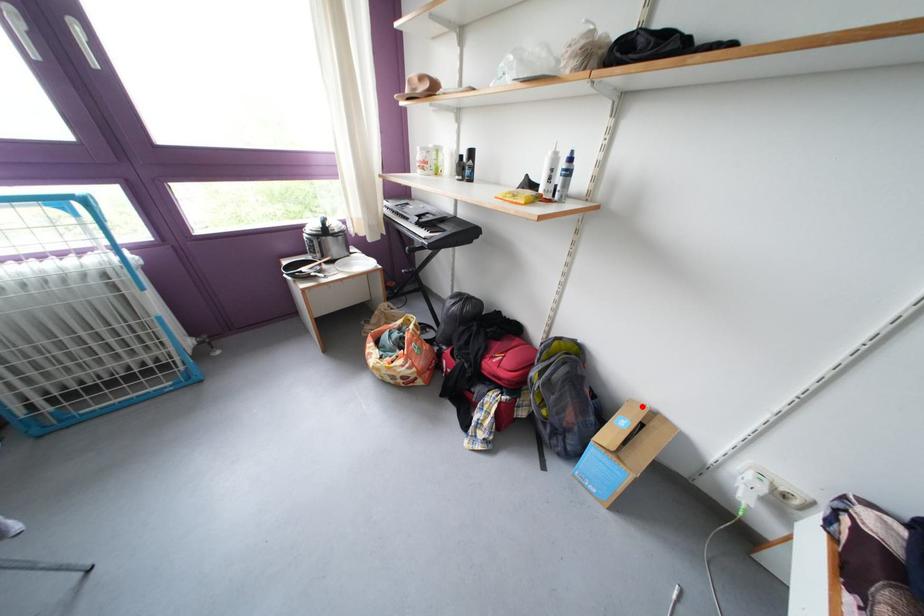
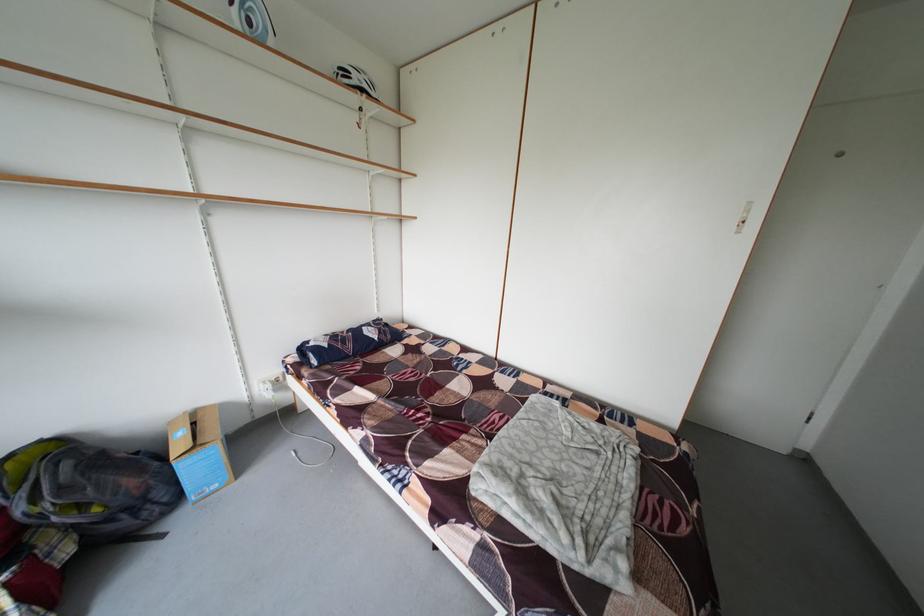
Find the pixel in the second image that matches the highlighted location in the first image.

(181, 428)